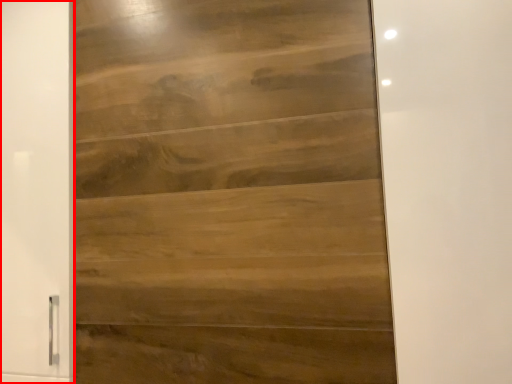
Question: From the image's perspective, considering the relative positions of barn door (annotated by the red box) and door in the image provided, where is barn door (annotated by the red box) located with respect to the staircase?

Choices:
 (A) above
 (B) below

Answer: (B)